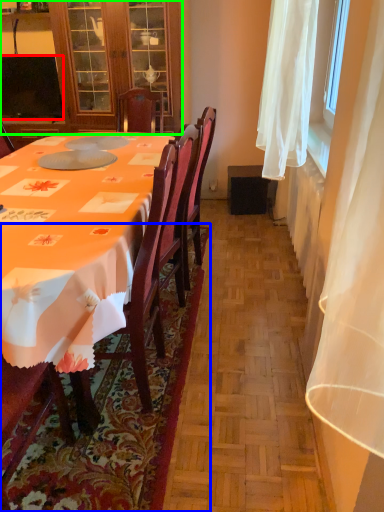
Question: Considering the real-world distances, which object is closest to television (highlighted by a red box)? mat (highlighted by a blue box) or cabinetry (highlighted by a green box).

Choices:
 (A) mat
 (B) cabinetry

Answer: (B)